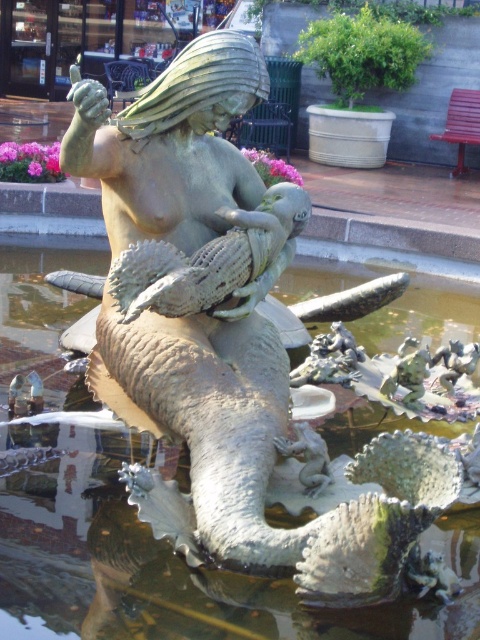
You are a maintenance worker needing to clean both the greenish stone water at center and the matte bronze fish at center. Given that your cleaning tool has a maximum reach of 1.8 meters, can you clean both areas without moving your position?

The greenish stone water at center and the matte bronze fish at center are 1.90 meters apart. Since your tool only reaches 1.8 meters, you cannot clean both areas without moving your position.

You are designing a small garden and want to place a decorative item next to the greenish stone water at center. Considering the space, will the matte bronze fish at center fit alongside it without overcrowding the area?

The greenish stone water at center is wider than the matte bronze fish at center, so there should be enough space to place the decorative item next to it without overcrowding.